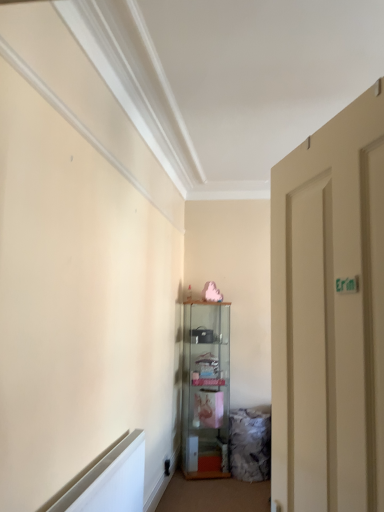
Question: Is beige matte door at right closer to the viewer compared to clear glass cabinet at center?

Choices:
 (A) no
 (B) yes

Answer: (B)

Question: Considering the relative sizes of beige matte door at right and clear glass cabinet at center in the image provided, is beige matte door at right bigger than clear glass cabinet at center?

Choices:
 (A) yes
 (B) no

Answer: (B)

Question: Is clear glass cabinet at center inside beige matte door at right?

Choices:
 (A) no
 (B) yes

Answer: (A)

Question: Can you confirm if beige matte door at right is smaller than clear glass cabinet at center?

Choices:
 (A) no
 (B) yes

Answer: (B)

Question: Is beige matte door at right to the right of clear glass cabinet at center from the viewer's perspective?

Choices:
 (A) no
 (B) yes

Answer: (B)

Question: Is beige matte door at right outside of clear glass cabinet at center?

Choices:
 (A) yes
 (B) no

Answer: (A)

Question: From the image's perspective, is clear glass cabinet at center beneath beige matte door at right?

Choices:
 (A) no
 (B) yes

Answer: (B)

Question: Is clear glass cabinet at center smaller than beige matte door at right?

Choices:
 (A) yes
 (B) no

Answer: (B)

Question: Does clear glass cabinet at center come in front of beige matte door at right?

Choices:
 (A) yes
 (B) no

Answer: (B)

Question: Is clear glass cabinet at center next to beige matte door at right?

Choices:
 (A) yes
 (B) no

Answer: (B)

Question: Is clear glass cabinet at center aimed at beige matte door at right?

Choices:
 (A) yes
 (B) no

Answer: (A)

Question: Would you consider clear glass cabinet at center to be distant from beige matte door at right?

Choices:
 (A) no
 (B) yes

Answer: (B)

Question: Based on their positions, is clear glass cabinet at center located to the left or right of beige matte door at right?

Choices:
 (A) right
 (B) left

Answer: (B)